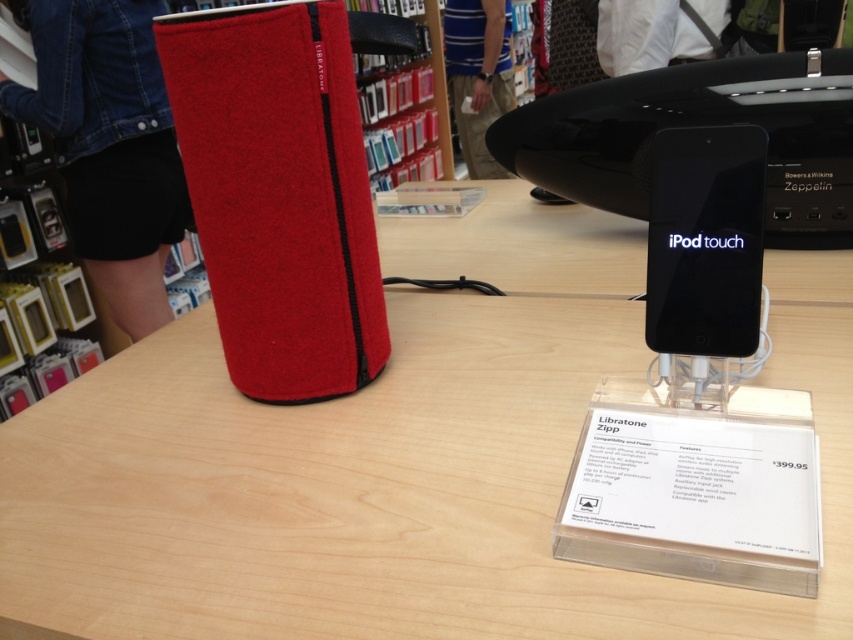
Does wooden table at center have a lesser height compared to black glossy ipod touch at center?

Incorrect, wooden table at center's height does not fall short of black glossy ipod touch at center's.

In the scene shown: Between wooden table at center and black glossy ipod touch at center, which one has more height?

wooden table at center is taller.

At what (x,y) coordinates should I click in order to perform the action: click on wooden table at center. Please return your answer as a coordinate pair (x, y). This screenshot has width=853, height=640. Looking at the image, I should click on (398, 461).